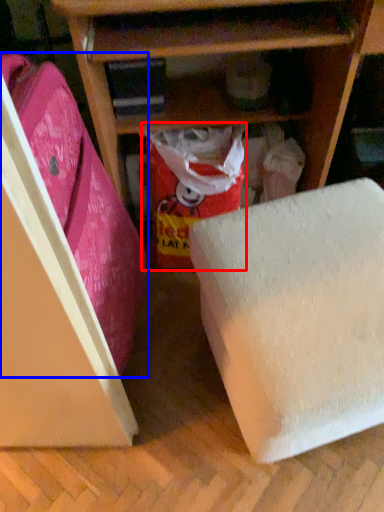
Question: Which object appears closest to the camera in this image, wrapping paper (highlighted by a red box) or leftover (highlighted by a blue box)?

Choices:
 (A) wrapping paper
 (B) leftover

Answer: (B)